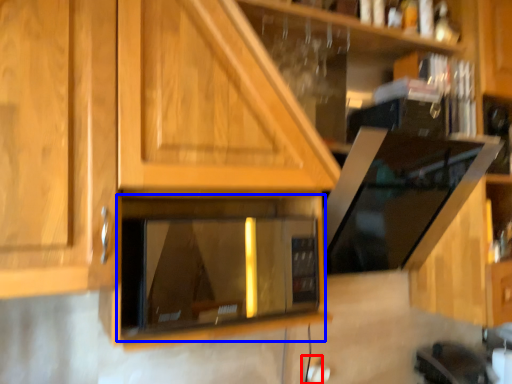
Question: Among these objects, which one is farthest to the camera, electric outlet (highlighted by a red box) or appliance (highlighted by a blue box)?

Choices:
 (A) electric outlet
 (B) appliance

Answer: (A)